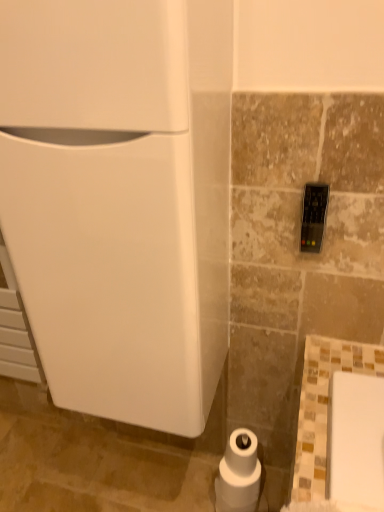
Question: Is white matte toilet paper at center facing away from white glossy refrigerator at left?

Choices:
 (A) yes
 (B) no

Answer: (B)

Question: Considering the relative sizes of white matte toilet paper at center and white glossy refrigerator at left in the image provided, is white matte toilet paper at center taller than white glossy refrigerator at left?

Choices:
 (A) yes
 (B) no

Answer: (B)

Question: Is white matte toilet paper at center outside of white glossy refrigerator at left?

Choices:
 (A) yes
 (B) no

Answer: (A)

Question: From the image's perspective, does white matte toilet paper at center appear higher than white glossy refrigerator at left?

Choices:
 (A) yes
 (B) no

Answer: (B)

Question: From a real-world perspective, is white matte toilet paper at center on white glossy refrigerator at left?

Choices:
 (A) no
 (B) yes

Answer: (A)

Question: From a real-world perspective, is white matte toilet paper at center located beneath white glossy refrigerator at left?

Choices:
 (A) no
 (B) yes

Answer: (B)

Question: Can you confirm if white glossy refrigerator at left is taller than white matte toilet paper at center?

Choices:
 (A) yes
 (B) no

Answer: (A)

Question: Considering the relative sizes of white glossy refrigerator at left and white matte toilet paper at center in the image provided, is white glossy refrigerator at left thinner than white matte toilet paper at center?

Choices:
 (A) no
 (B) yes

Answer: (A)

Question: Does white glossy refrigerator at left have a greater width compared to white matte toilet paper at center?

Choices:
 (A) yes
 (B) no

Answer: (A)

Question: Does white glossy refrigerator at left turn towards white matte toilet paper at center?

Choices:
 (A) yes
 (B) no

Answer: (B)

Question: Is white glossy refrigerator at left shorter than white matte toilet paper at center?

Choices:
 (A) no
 (B) yes

Answer: (A)

Question: From the image's perspective, is white glossy refrigerator at left on white matte toilet paper at center?

Choices:
 (A) yes
 (B) no

Answer: (A)

Question: From a real-world perspective, is white matte toilet paper at center physically located above or below white glossy refrigerator at left?

Choices:
 (A) below
 (B) above

Answer: (A)